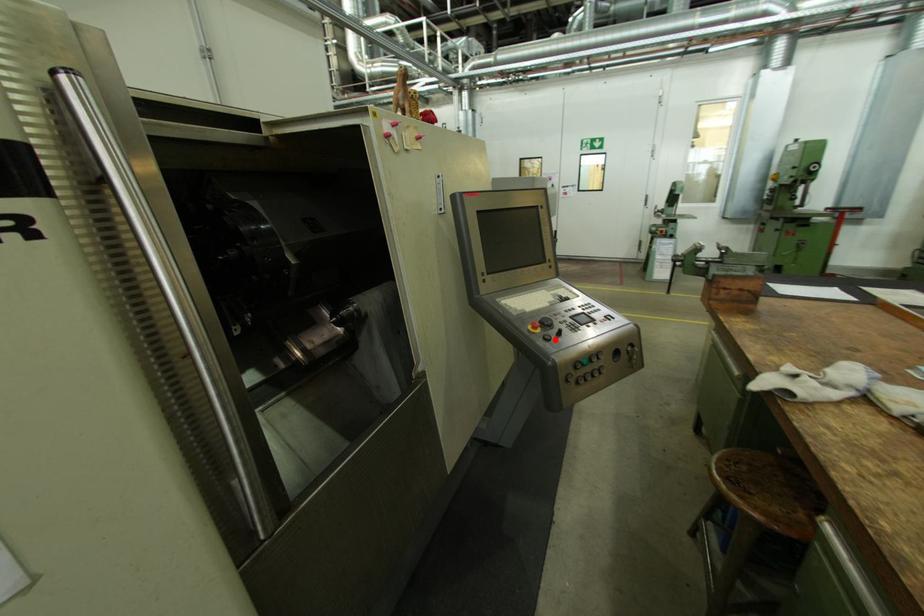
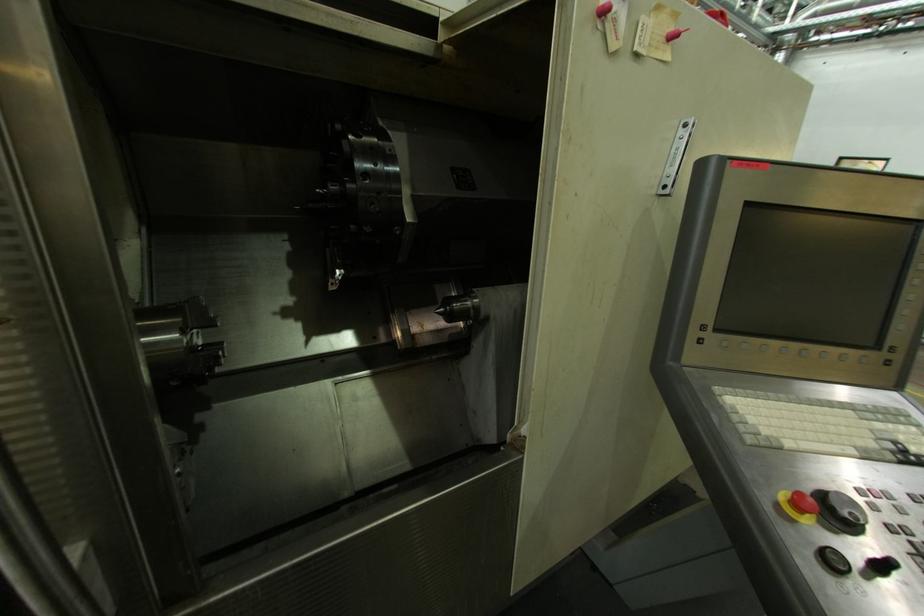
The point at the highlighted location is marked in the first image. Where is the corresponding point in the second image?

(847, 570)